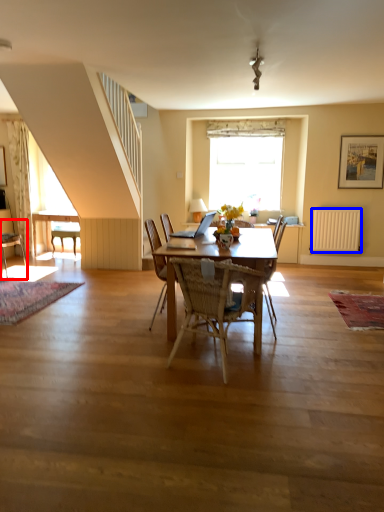
Question: Which of the following is the closest to the observer, chair (highlighted by a red box) or radiator (highlighted by a blue box)?

Choices:
 (A) chair
 (B) radiator

Answer: (A)